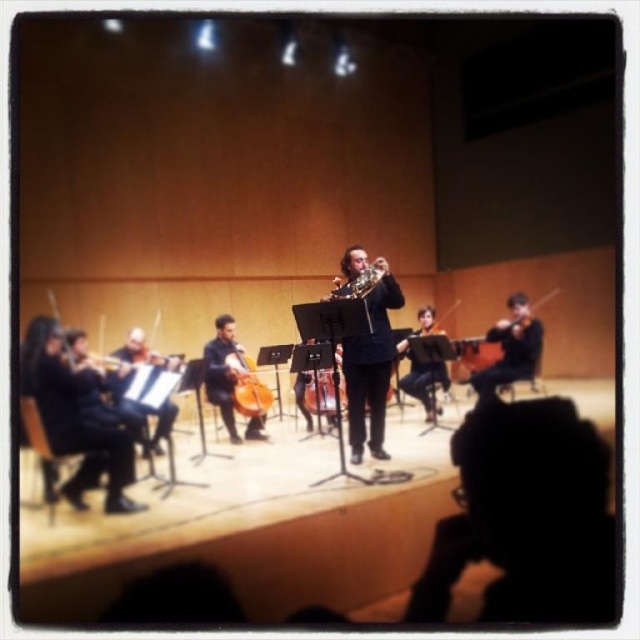
Question: Can you confirm if black matte violin at left is smaller than wooden violin at left?

Choices:
 (A) no
 (B) yes

Answer: (A)

Question: Does wooden polished cello at center have a larger size compared to wooden cello at center?

Choices:
 (A) yes
 (B) no

Answer: (B)

Question: Estimate the real-world distances between objects in this image. Which object is farther from the wooden polished cello at center?

Choices:
 (A) black matte violin at left
 (B) shiny brass trumpet at center
 (C) shiny black jacket at center

Answer: (A)

Question: Which point is closer to the camera?

Choices:
 (A) (362, 438)
 (B) (365, 275)

Answer: (B)

Question: Is matte black cello at center to the left of wooden cello at center from the viewer's perspective?

Choices:
 (A) yes
 (B) no

Answer: (A)

Question: Which object appears closest to the camera in this image?

Choices:
 (A) wooden violin at left
 (B) shiny black jacket at center

Answer: (A)